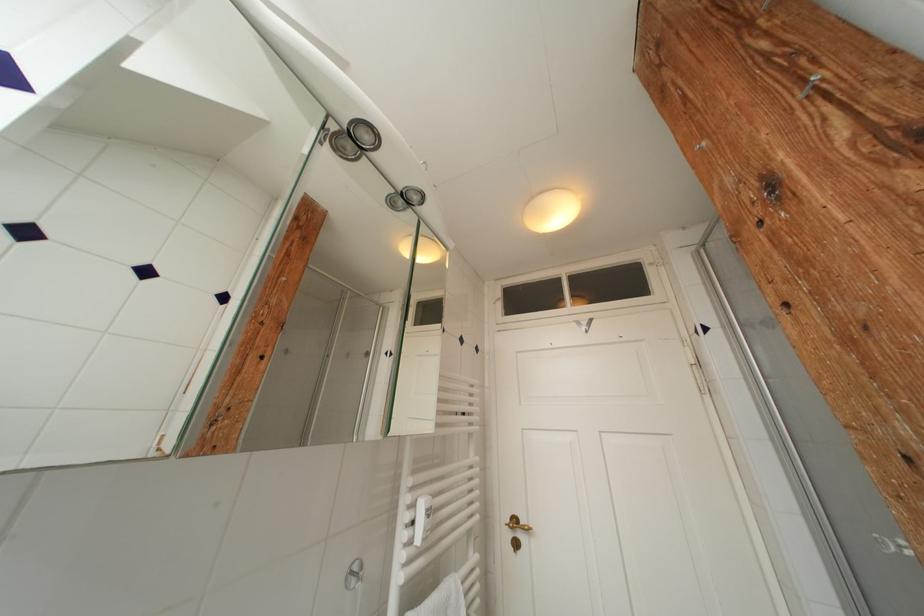
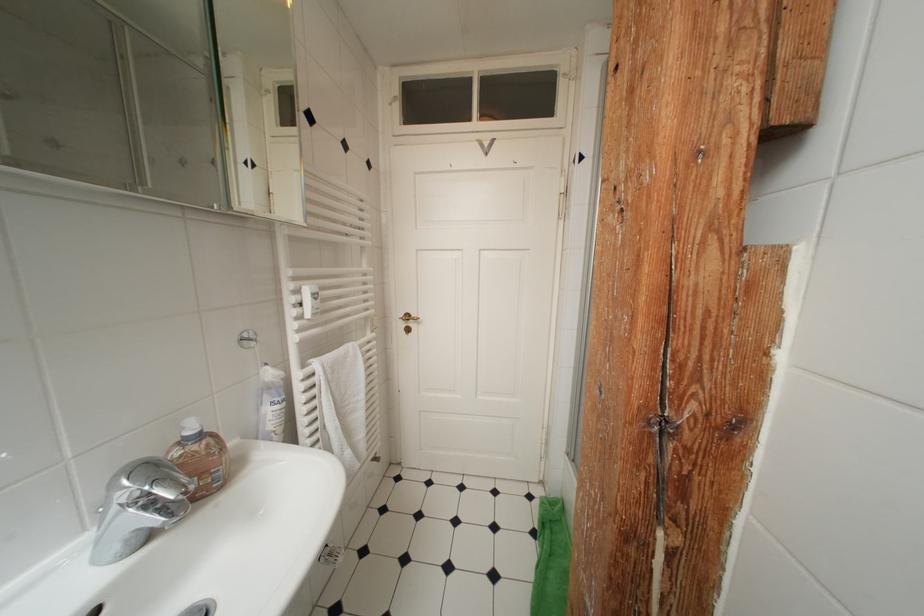
Locate, in the second image, the point that corresponds to (x=521, y=525) in the first image.

(415, 320)